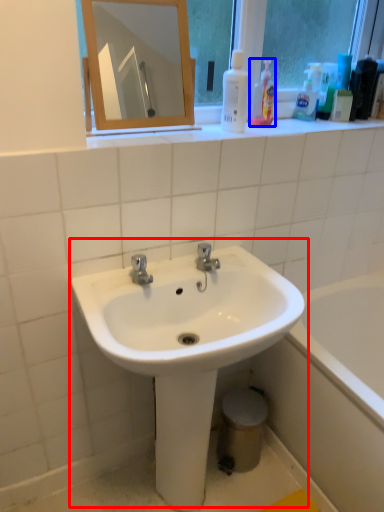
Question: Which object appears closest to the camera in this image, sink (highlighted by a red box) or cleaning product (highlighted by a blue box)?

Choices:
 (A) sink
 (B) cleaning product

Answer: (A)